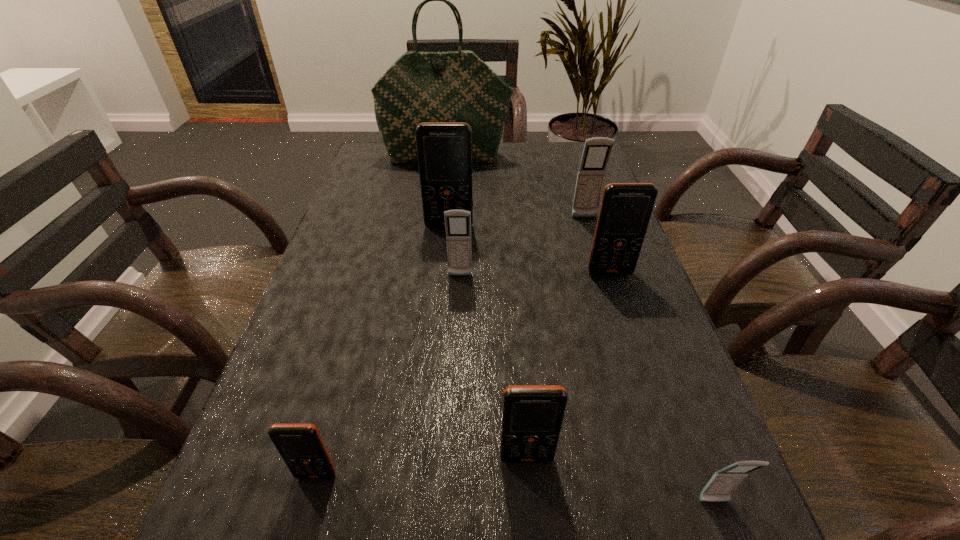
Select which object appears as the sixth closest to the second nearest orange cellular telephone. Please provide its 2D coordinates. Your answer should be formatted as a tuple, i.e. [(x, y)], where the tuple contains the x and y coordinates of a point satisfying the conditions above.

[(597, 150)]

Where is `cellular telephone that stands as the third closest to the farthest orange cellular telephone`? Image resolution: width=960 pixels, height=540 pixels. cellular telephone that stands as the third closest to the farthest orange cellular telephone is located at coordinates (626, 208).

Identify which cellular telephone is the sixth nearest to the tallest object. Please provide its 2D coordinates. Your answer should be formatted as a tuple, i.e. [(x, y)], where the tuple contains the x and y coordinates of a point satisfying the conditions above.

[(301, 446)]

Choose which orange cellular telephone is the nearest neighbor to the second farthest orange cellular telephone. Please provide its 2D coordinates. Your answer should be formatted as a tuple, i.e. [(x, y)], where the tuple contains the x and y coordinates of a point satisfying the conditions above.

[(444, 149)]

This screenshot has height=540, width=960. Find the location of `the second closest orange cellular telephone relative to the leftmost orange cellular telephone`. the second closest orange cellular telephone relative to the leftmost orange cellular telephone is located at coordinates (444, 149).

Identify which gray cellular telephone is located as the third nearest to the tote bag. Please provide its 2D coordinates. Your answer should be formatted as a tuple, i.e. [(x, y)], where the tuple contains the x and y coordinates of a point satisfying the conditions above.

[(719, 488)]

Where is `the second closest gray cellular telephone to the second nearest object`? the second closest gray cellular telephone to the second nearest object is located at coordinates (719, 488).